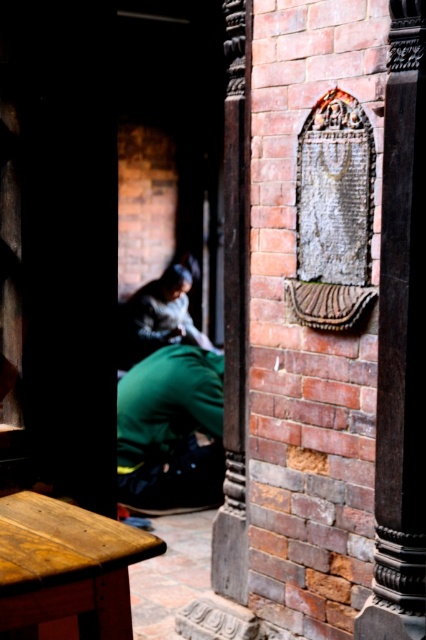
Who is higher up, wooden stool at lower left or dark brown wood pillar at center?

dark brown wood pillar at center is higher up.

Is wooden stool at lower left closer to camera compared to dark brown wood pillar at center?

Yes, wooden stool at lower left is in front of dark brown wood pillar at center.

Locate an element on the screen. wooden stool at lower left is located at coordinates (66, 564).

Which is more to the right, smooth stone pillar at center or dark brown wood pillar at center?

Positioned to the right is smooth stone pillar at center.

Looking at this image, is smooth stone pillar at center shorter than dark brown wood pillar at center?

Yes.

This screenshot has height=640, width=426. In order to click on smooth stone pillar at center in this screenshot , I will do `click(400, 344)`.

Which of these two, wooden stool at lower left or green fabric squat at lower left, stands taller?

green fabric squat at lower left is taller.

The height and width of the screenshot is (640, 426). What do you see at coordinates (66, 564) in the screenshot?
I see `wooden stool at lower left` at bounding box center [66, 564].

At what (x,y) coordinates should I click in order to perform the action: click on wooden stool at lower left. Please return your answer as a coordinate pair (x, y). The width and height of the screenshot is (426, 640). Looking at the image, I should click on (66, 564).